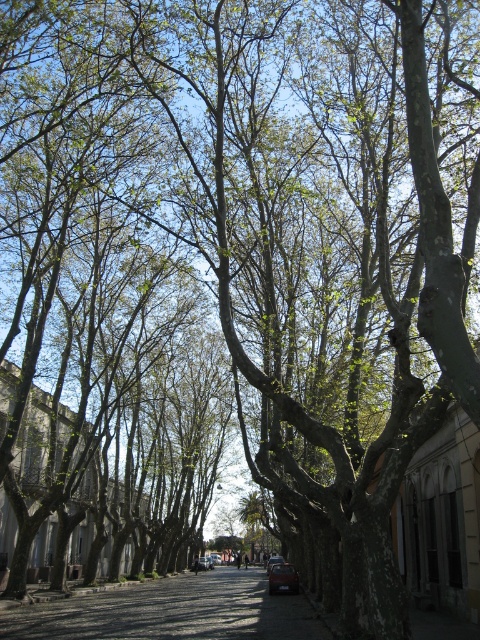
Question: Which point is farther to the camera?

Choices:
 (A) metallic silver car at center
 (B) shiny red car at center
 (C) smooth asphalt road at center
 (D) matte red car at center

Answer: (D)

Question: Which point is closer to the camera?

Choices:
 (A) (267, 566)
 (B) (207, 568)

Answer: (B)

Question: Which of the following is the farthest from the observer?

Choices:
 (A) (200, 556)
 (B) (111, 618)
 (C) (278, 556)

Answer: (A)

Question: Where is shiny red car at center located in relation to metallic silver car at center in the image?

Choices:
 (A) right
 (B) left

Answer: (B)

Question: Does smooth asphalt road at center come in front of matte red car at center?

Choices:
 (A) yes
 (B) no

Answer: (A)

Question: Does matte red car at center appear on the left side of metallic silver car at center?

Choices:
 (A) yes
 (B) no

Answer: (A)